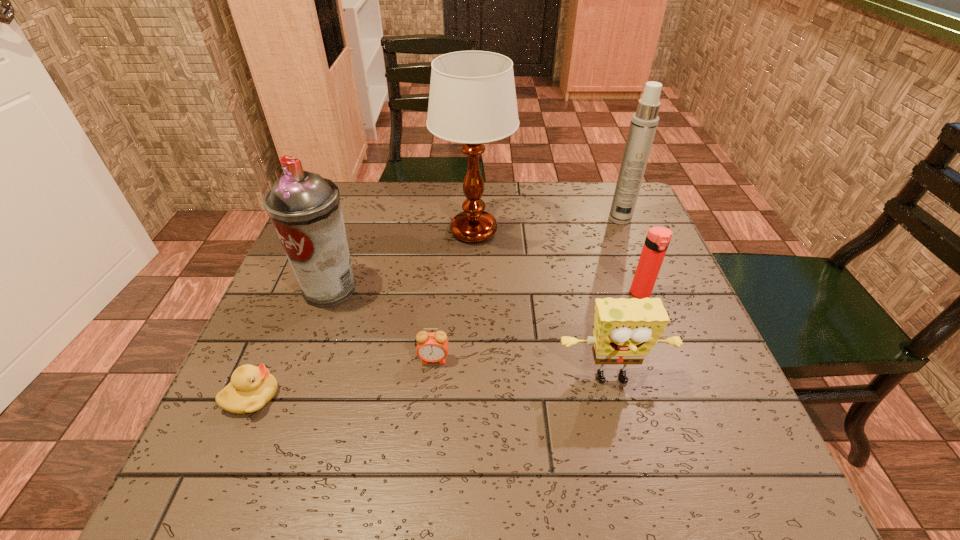
You are a GUI agent. You are given a task and a screenshot of the screen. Output one action in this format:
    pyautogui.click(x=<x>, y=<y>)
    Task: Click on the vacant area situated 0.150m on the front-facing side of the sponge
    This screenshot has height=540, width=960.
    Given the screenshot: What is the action you would take?
    pyautogui.click(x=639, y=486)

You are a GUI agent. You are given a task and a screenshot of the screen. Output one action in this format:
    pyautogui.click(x=<x>, y=<y>)
    Task: Click on the free space located on the back of the thermos bottle
    The width and height of the screenshot is (960, 540).
    Given the screenshot: What is the action you would take?
    pyautogui.click(x=628, y=260)

Identify the location of vacant region located on the face of the alarm clock. (423, 477).

Locate an element on the screen. vacant space located on the front-facing side of the duckling is located at coordinates (468, 396).

This screenshot has width=960, height=540. In order to click on table lamp that is at the far edge in this screenshot , I will do `click(472, 100)`.

Locate an element on the screen. aerosol can that is at the far edge is located at coordinates (644, 122).

Where is `aerosol can positioned at the left edge`? aerosol can positioned at the left edge is located at coordinates (305, 209).

Locate an element on the screen. duckling at the left edge is located at coordinates (251, 388).

Where is `aerosol can situated at the right edge`? The height and width of the screenshot is (540, 960). aerosol can situated at the right edge is located at coordinates (644, 122).

At what (x,y) coordinates should I click in order to perform the action: click on sponge present at the right edge. Please return your answer as a coordinate pair (x, y). This screenshot has height=540, width=960. Looking at the image, I should click on (625, 330).